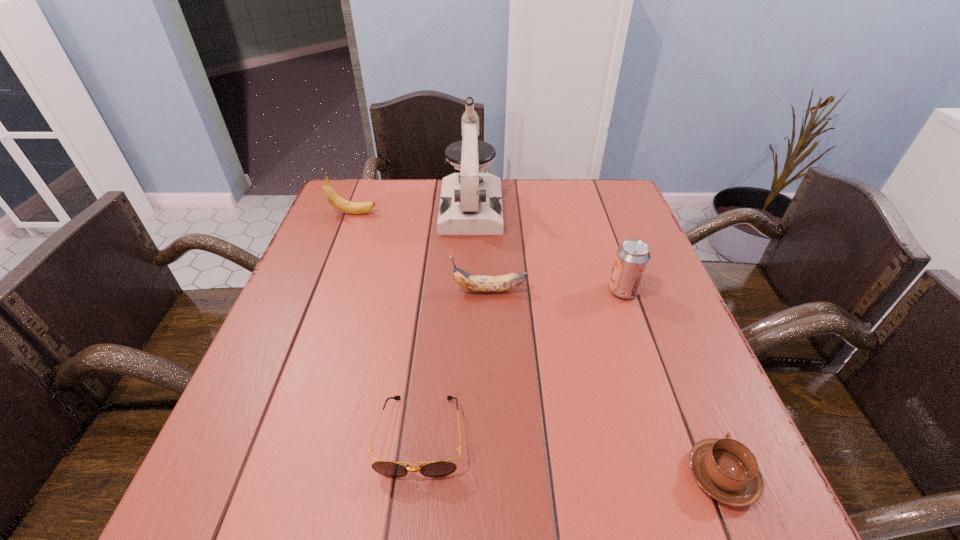
I want to click on vacant space located 0.370m on the front of the beer can, so click(682, 460).

At what (x,y) coordinates should I click in order to perform the action: click on free space located 0.170m at the stem of the shorter banana. Please return your answer as a coordinate pair (x, y). Looking at the image, I should click on (378, 290).

You are a GUI agent. You are given a task and a screenshot of the screen. Output one action in this format:
    pyautogui.click(x=<x>, y=<y>)
    Task: Click on the vacant point located at the stem of the shorter banana
    The image size is (960, 540).
    Given the screenshot: What is the action you would take?
    pyautogui.click(x=361, y=290)

Image resolution: width=960 pixels, height=540 pixels. Identify the location of free location located 0.100m at the stem of the shorter banana. (408, 290).

Image resolution: width=960 pixels, height=540 pixels. Find the location of `vacant region located on the side of the cappuccino with the handle`. vacant region located on the side of the cappuccino with the handle is located at coordinates (666, 339).

Find the location of a particular element. free location located on the side of the cappuccino with the handle is located at coordinates (668, 343).

At what (x,y) coordinates should I click in order to perform the action: click on vacant space located on the side of the cappuccino with the handle. Please return your answer as a coordinate pair (x, y). This screenshot has height=540, width=960. Looking at the image, I should click on (656, 312).

I want to click on microscope located at the far edge, so click(x=471, y=202).

Locate an element on the screen. The image size is (960, 540). banana situated at the far edge is located at coordinates (331, 196).

Where is `cappuccino located in the near edge section of the desktop`? The image size is (960, 540). cappuccino located in the near edge section of the desktop is located at coordinates (727, 470).